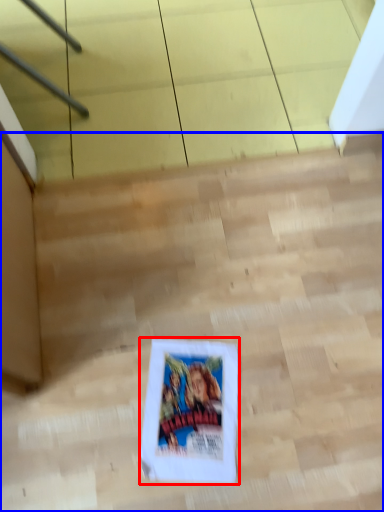
Question: Which of the following is the closest to the observer, comic book (highlighted by a red box) or stairwell (highlighted by a blue box)?

Choices:
 (A) comic book
 (B) stairwell

Answer: (B)